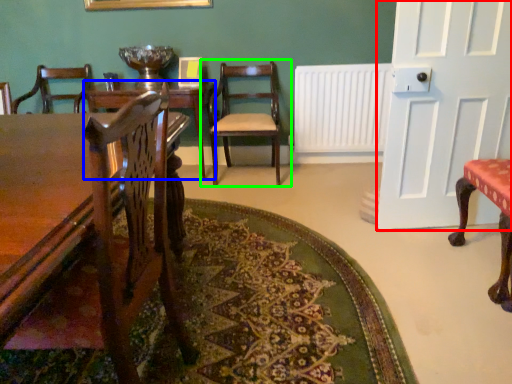
Question: Based on their relative distances, which object is nearer to door (highlighted by a red box)? Choose from table (highlighted by a blue box) and chair (highlighted by a green box).

Choices:
 (A) table
 (B) chair

Answer: (B)